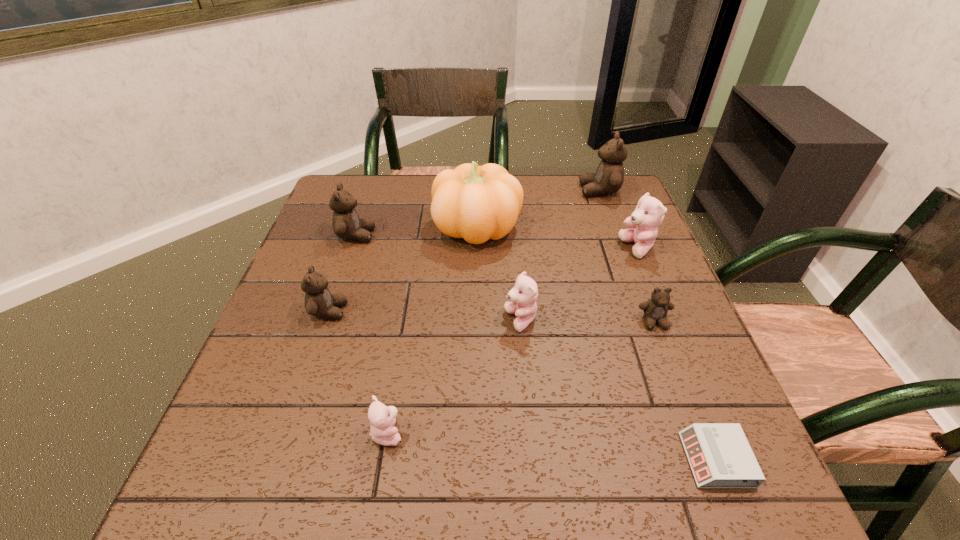
At what (x,y) coordinates should I click in order to perform the action: click on free space located 0.130m on the face of the second farthest brown teddy bear. Please return your answer as a coordinate pair (x, y). This screenshot has height=540, width=960. Looking at the image, I should click on (423, 235).

Where is `vacant space located on the face of the second smallest brown teddy bear`? vacant space located on the face of the second smallest brown teddy bear is located at coordinates (373, 311).

I want to click on free space located at the face of the second smallest pink teddy bear, so pos(449,320).

In order to click on free space located at the face of the second smallest pink teddy bear in this screenshot , I will do `click(368, 320)`.

Where is `vacant area located at the face of the second smallest pink teddy bear`? This screenshot has height=540, width=960. vacant area located at the face of the second smallest pink teddy bear is located at coordinates (335, 320).

Identify the location of free point located 0.360m on the face of the smallest brown teddy bear. This screenshot has height=540, width=960. (727, 511).

Identify the location of vacant space located 0.270m at the face of the fifth teddy bear from right to left. (557, 433).

The width and height of the screenshot is (960, 540). What are the coordinates of `vacant space located on the left of the alarm clock` in the screenshot? It's located at (508, 460).

Find the location of a particular element. pumpkin located in the far edge section of the desktop is located at coordinates (477, 203).

Find the location of a particular element. teddy bear at the far edge is located at coordinates (609, 177).